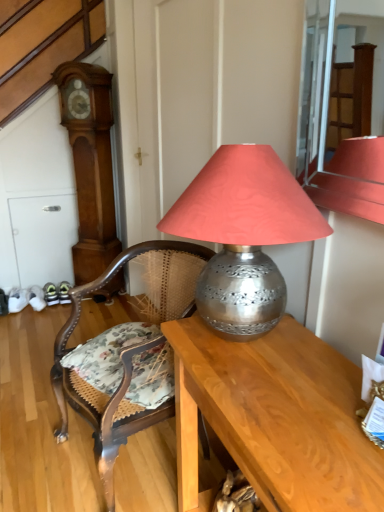
Question: Is metallic silver lamp at center in front of or behind wooden grandfather clock at left in the image?

Choices:
 (A) front
 (B) behind

Answer: (A)

Question: From a real-world perspective, relative to wooden grandfather clock at left, is metallic silver lamp at center vertically above or below?

Choices:
 (A) above
 (B) below

Answer: (A)

Question: Considering the real-world distances, which object is farthest from the metallic silver lamp at center?

Choices:
 (A) wooden cane chair at center
 (B) wooden grandfather clock at left
 (C) wooden desk at center

Answer: (B)

Question: Which is nearer to the wooden cane chair at center?

Choices:
 (A) wooden desk at center
 (B) wooden grandfather clock at left
 (C) metallic silver lamp at center

Answer: (A)